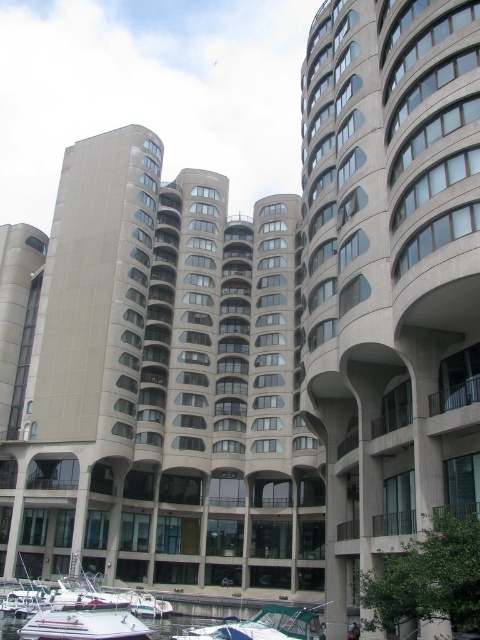
Based on the photo, who is more distant from viewer, (156, 499) or (315, 609)?

Point (156, 499)

At what (x,y) coordinates should I click in order to perform the action: click on gray concrete building at center. Please return your answer as a coordinate pair (x, y). This screenshot has width=480, height=640. Looking at the image, I should click on (155, 381).

Between gray concrete building at center and matte concrete building at center, which one has more height?

matte concrete building at center is taller.

Who is positioned more to the right, gray concrete building at center or matte concrete building at center?

matte concrete building at center is more to the right.

Between point (284, 436) and point (316, 52), which one is positioned behind?

Positioned behind is point (284, 436).

Where is `gray concrete building at center`? gray concrete building at center is located at coordinates (155, 381).

Does matte concrete building at center come in front of white matte boat at lower left?

Yes, it is.

Who is shorter, matte concrete building at center or white matte boat at lower left?

white matte boat at lower left is shorter.

Is point (334, 214) positioned behind point (115, 620)?

Yes, it is.

Locate an element on the screen. This screenshot has width=480, height=640. matte concrete building at center is located at coordinates (391, 269).